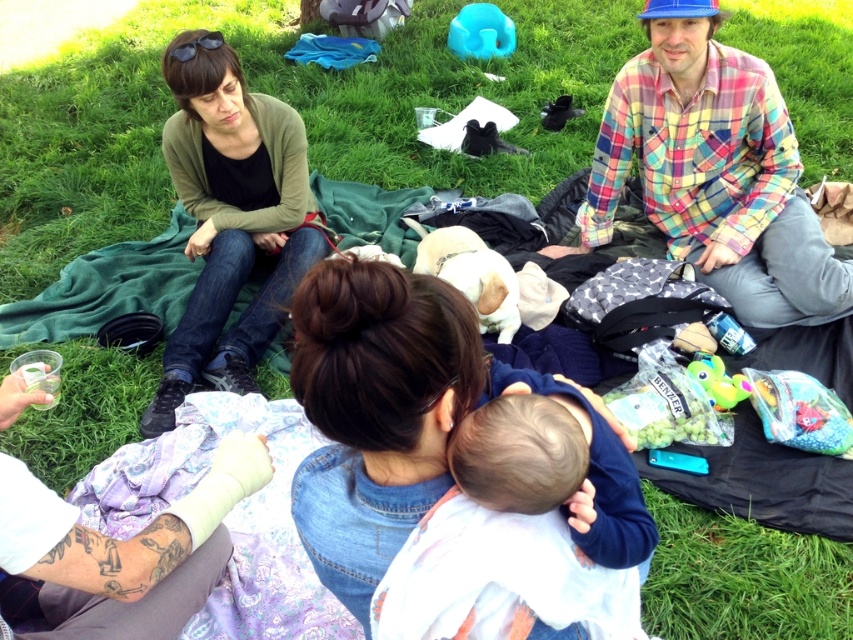
Question: Which of the following is the closest to the observer?

Choices:
 (A) brown denim jacket at center
 (B) multicolored plaid shirt at upper right
 (C) green matte cardigan at upper left
 (D) white bandaged arm at lower left

Answer: (A)

Question: Where is green matte cardigan at upper left located in relation to white bandaged arm at lower left in the image?

Choices:
 (A) above
 (B) below

Answer: (A)

Question: Can you confirm if brown denim jacket at center is wider than white bandaged arm at lower left?

Choices:
 (A) no
 (B) yes

Answer: (A)

Question: Which of these objects is positioned farthest from the green matte cardigan at upper left?

Choices:
 (A) multicolored plaid shirt at upper right
 (B) white bandaged arm at lower left
 (C) brown denim jacket at center

Answer: (C)

Question: Among these objects, which one is nearest to the camera?

Choices:
 (A) brown denim jacket at center
 (B) white bandaged arm at lower left
 (C) green matte cardigan at upper left

Answer: (A)

Question: Is multicolored plaid shirt at upper right positioned behind green matte cardigan at upper left?

Choices:
 (A) yes
 (B) no

Answer: (A)